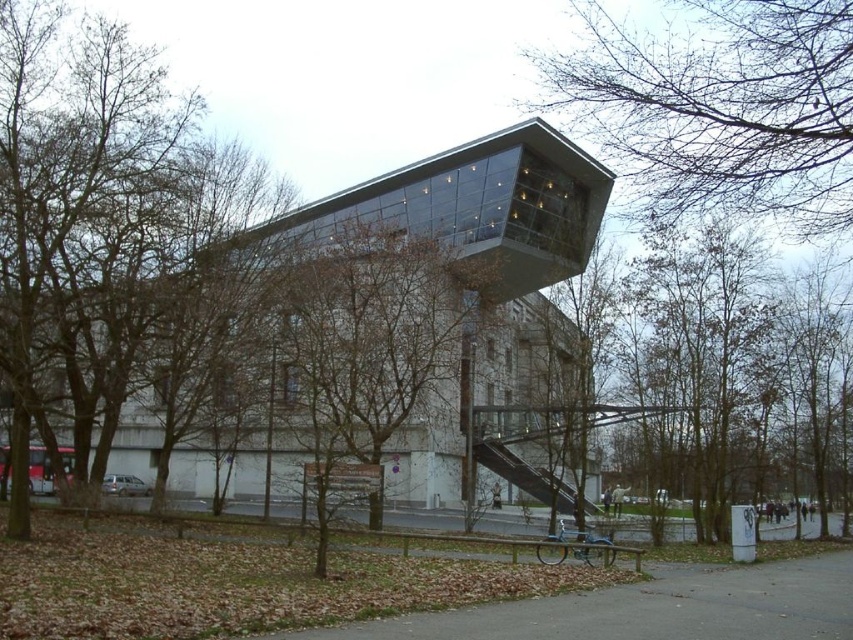
You are standing on the paved pathway near the bicycle. Looking towards the building, which object do you see first between the bare branches at upper center and the brown leafy tree at center?

The bare branches at upper center is above the brown leafy tree at center, so you would see the bare branches at upper center first when looking towards the building.

You are an urban planner evaluating the park layout. The bare branches at upper center and the brown leafy tree at center are both in the foreground. Which tree takes up more visual space in the image?

The brown leafy tree at center occupies more visual space than the bare branches at upper center.

You are a visitor standing at the entrance of the modern building. You notice two trees in the scene. Which one is taller between the bare branches at upper center and the brown leafy tree at center?

The brown leafy tree at center is taller than the bare branches at upper center.